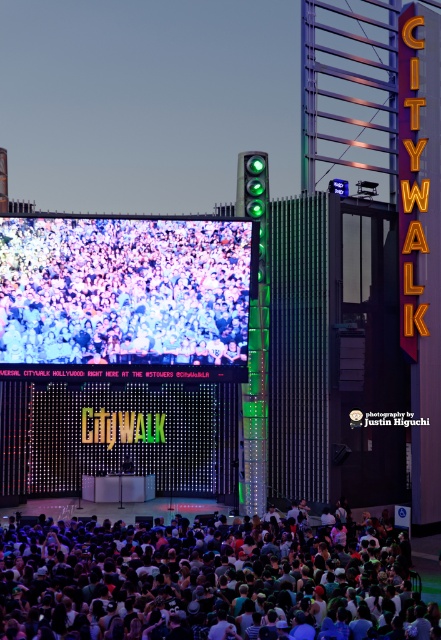
You are a photographer at Universal CityWalk Hollywood and need to capture a photo that includes both the dark gray fabric crowd at lower center and the multicolored fabric crowd at center. Which crowd should you focus on first to ensure both are in frame?

You should focus on the dark gray fabric crowd at lower center first since it is larger in size than the multicolored fabric crowd at center, allowing you to frame both effectively.

You are standing at the point marked by the coordinate point (209, 580) in the image. Based on the scene description, what is the closest object or feature you would be facing?

The closest object to the point (209, 580) is the dark gray fabric crowd at lower center, as the coordinate corresponds to its location.